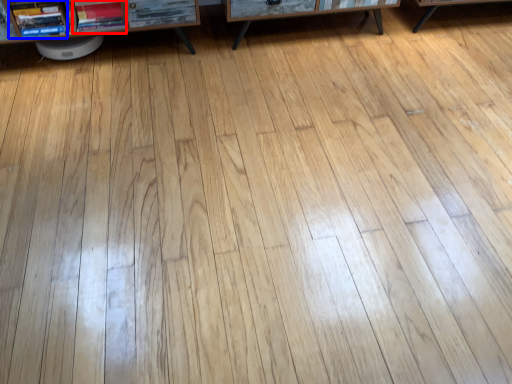
Question: Which object appears farthest to the camera in this image, book (highlighted by a red box) or book (highlighted by a blue box)?

Choices:
 (A) book
 (B) book

Answer: (A)